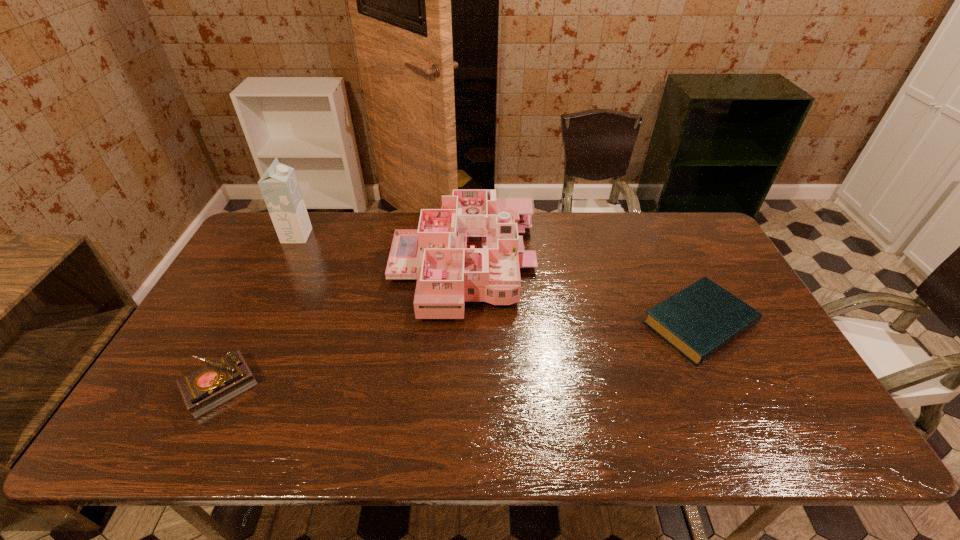
The height and width of the screenshot is (540, 960). What are the coordinates of `free space in the image that satisfies the following two spatial constraints: 1. at the front entrance of the rightmost object; 2. on the left side of the third object from left to right` in the screenshot? It's located at (462, 323).

Where is `free space that satisfies the following two spatial constraints: 1. on the front label of the carton; 2. on the right side of the rightmost object`? The height and width of the screenshot is (540, 960). free space that satisfies the following two spatial constraints: 1. on the front label of the carton; 2. on the right side of the rightmost object is located at coordinates (253, 323).

Identify the location of vacant area in the image that satisfies the following two spatial constraints: 1. at the front entrance of the third object from left to right; 2. on the back side of the shortest object. The image size is (960, 540). (462, 323).